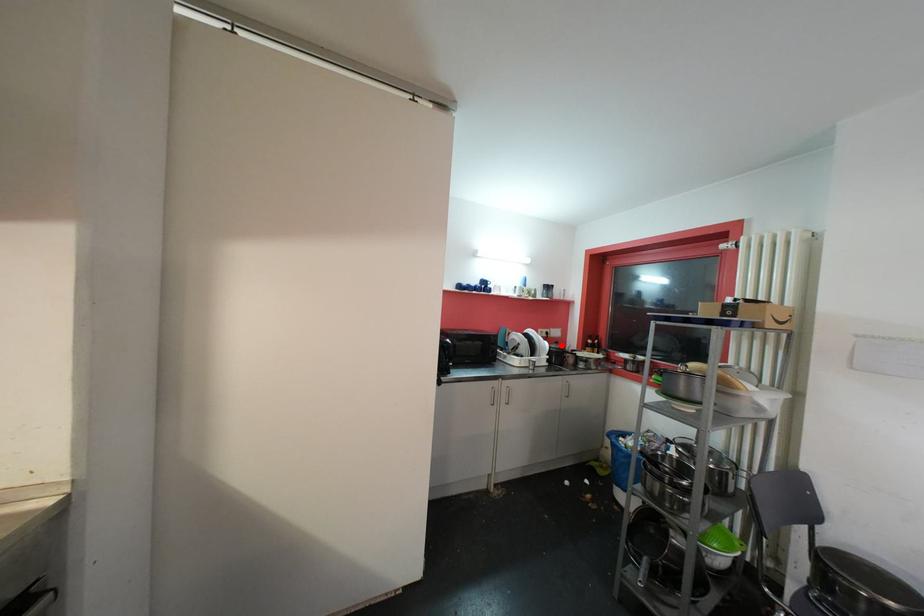
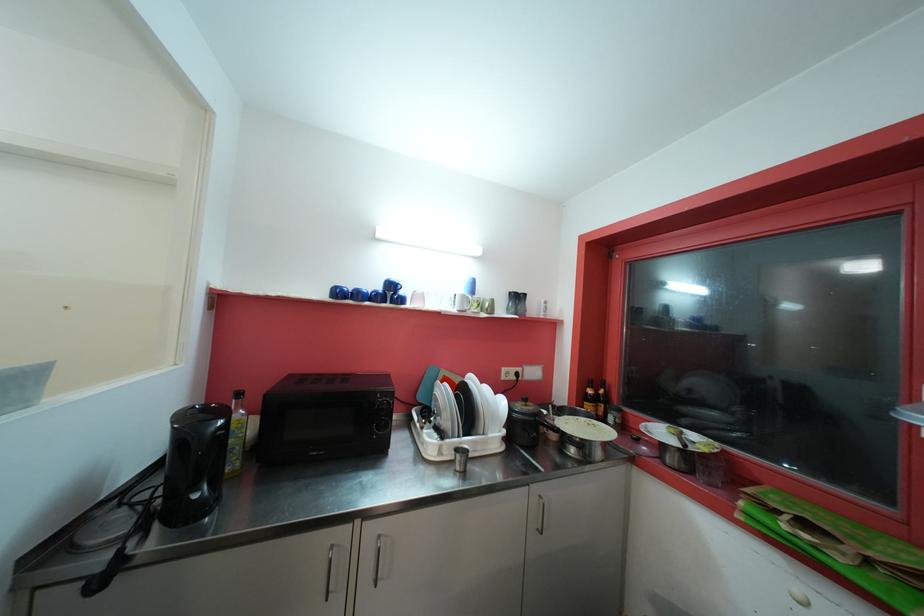
In the second image, find the point that corresponds to the highlighted location in the first image.

(530, 403)